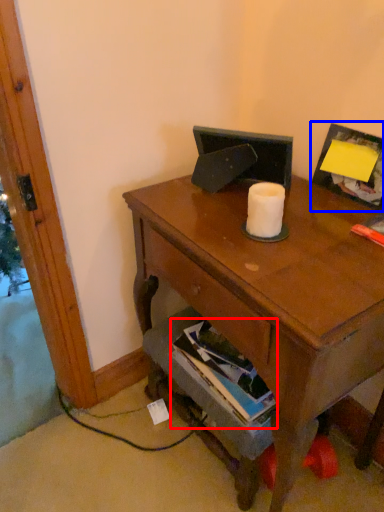
Question: Which point is further to the camera, book (highlighted by a red box) or picture frame (highlighted by a blue box)?

Choices:
 (A) book
 (B) picture frame

Answer: (A)